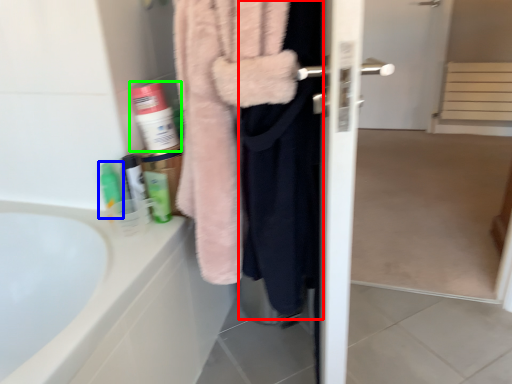
Question: Based on their relative distances, which object is nearer to clothing (highlighted by a red box)? Choose from toiletry (highlighted by a blue box) and cleaning product (highlighted by a green box).

Choices:
 (A) toiletry
 (B) cleaning product

Answer: (B)